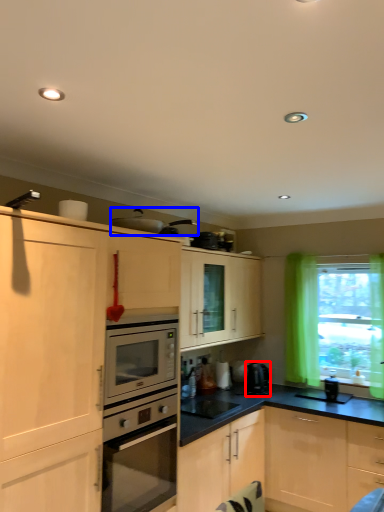
Question: Among these objects, which one is farthest to the camera, coffee machine (highlighted by a red box) or appliance (highlighted by a blue box)?

Choices:
 (A) coffee machine
 (B) appliance

Answer: (A)